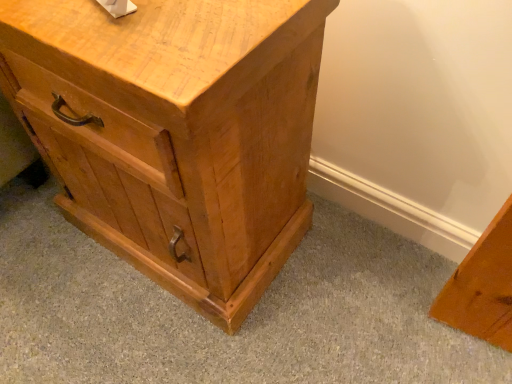
What do you see at coordinates (175, 132) in the screenshot? The width and height of the screenshot is (512, 384). I see `natural wood cabinet at center` at bounding box center [175, 132].

Find the location of a particular element. Image resolution: width=512 pixels, height=384 pixels. natural wood cabinet at center is located at coordinates (175, 132).

In order to face natural wood cabinet at center, should I rotate leftwards or rightwards?

It's best to rotate left around 13.595 degrees.

Locate an element on the screen. This screenshot has width=512, height=384. natural wood cabinet at center is located at coordinates (175, 132).